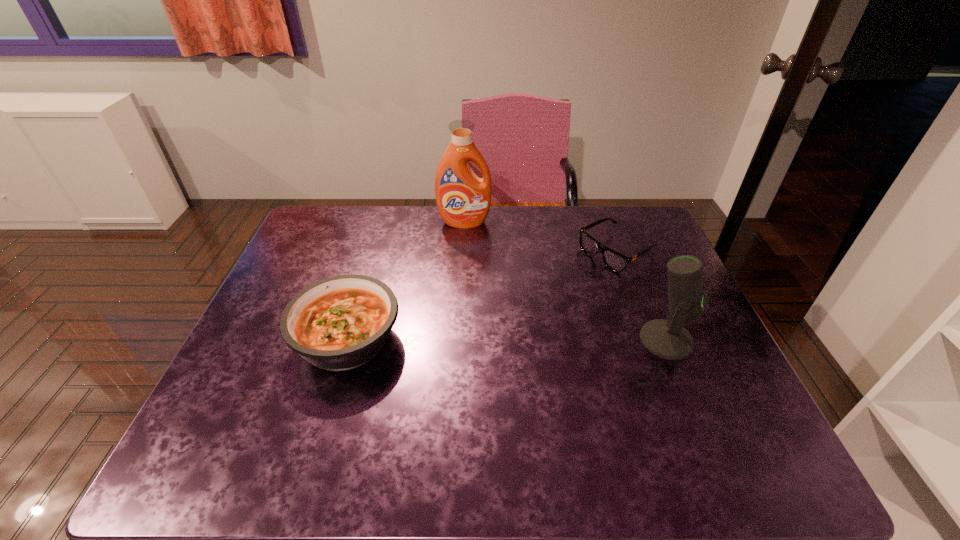
The width and height of the screenshot is (960, 540). Find the location of `vacant space located on the front-facing side of the sunglasses`. vacant space located on the front-facing side of the sunglasses is located at coordinates (492, 323).

At what (x,y) coordinates should I click in order to perform the action: click on vacant space located 0.140m on the front-facing side of the sunglasses. Please return your answer as a coordinate pair (x, y). The width and height of the screenshot is (960, 540). Looking at the image, I should click on click(556, 287).

Find the location of a particular element. vacant region located on the front-facing side of the third object from right to left is located at coordinates (468, 308).

Image resolution: width=960 pixels, height=540 pixels. I want to click on free spot located 0.380m on the front-facing side of the third object from right to left, so click(469, 314).

Identify the location of vacant region located 0.300m on the front-facing side of the third object from right to left. This screenshot has height=540, width=960. coord(468,292).

Identify the location of sunglasses that is at the far edge. pyautogui.click(x=613, y=260).

Locate an element on the screen. detergent positioned at the far edge is located at coordinates (463, 199).

I want to click on object at the left edge, so click(339, 323).

Identify the location of microphone at the right edge. The width and height of the screenshot is (960, 540). (668, 339).

In order to click on sunglasses that is positioned at the right edge in this screenshot , I will do `click(613, 260)`.